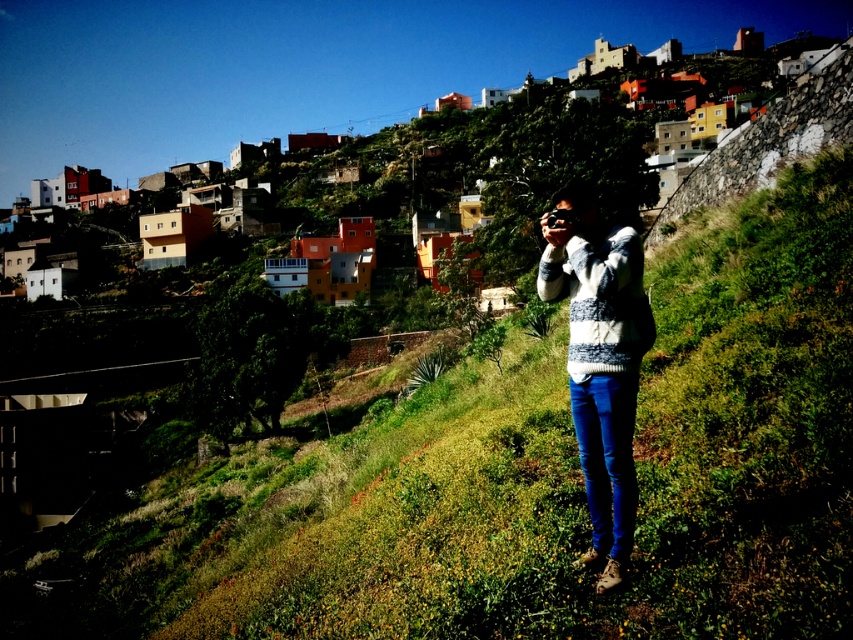
Does knitted sweater at center have a greater height compared to blue denim jeans at center?

Indeed, knitted sweater at center has a greater height compared to blue denim jeans at center.

Which is behind, point (561, 186) or point (599, 429)?

The point (561, 186) is more distant.

The width and height of the screenshot is (853, 640). What are the coordinates of `knitted sweater at center` in the screenshot? It's located at (601, 358).